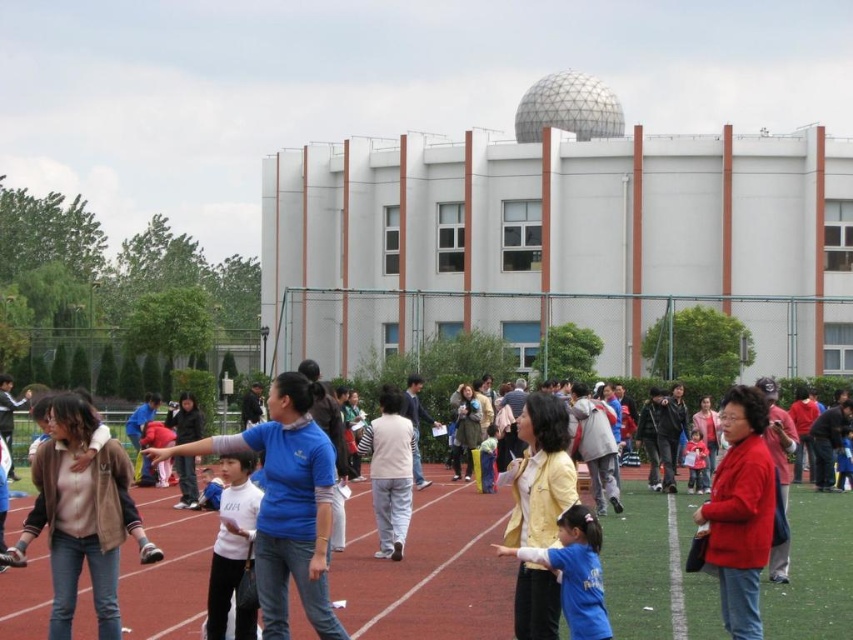
Question: Is matte pink shirt at center bigger than matte red jacket at center?

Choices:
 (A) yes
 (B) no

Answer: (A)

Question: Which object is farther from the camera taking this photo?

Choices:
 (A) matte pink shirt at center
 (B) blue fabric shirt at center

Answer: (A)

Question: Which point appears farthest from the camera in this image?

Choices:
 (A) (444, 609)
 (B) (695, 440)
 (C) (244, 522)
 (D) (723, 616)

Answer: (B)

Question: Is matte pink shirt at center to the right of matte red jacket at center from the viewer's perspective?

Choices:
 (A) yes
 (B) no

Answer: (B)

Question: From the image, what is the correct spatial relationship of green turf at center in relation to blue denim pants at center?

Choices:
 (A) below
 (B) above

Answer: (A)

Question: Which object appears closest to the camera in this image?

Choices:
 (A) blue fabric shirt at center
 (B) matte red jacket at center
 (C) green turf at center

Answer: (A)